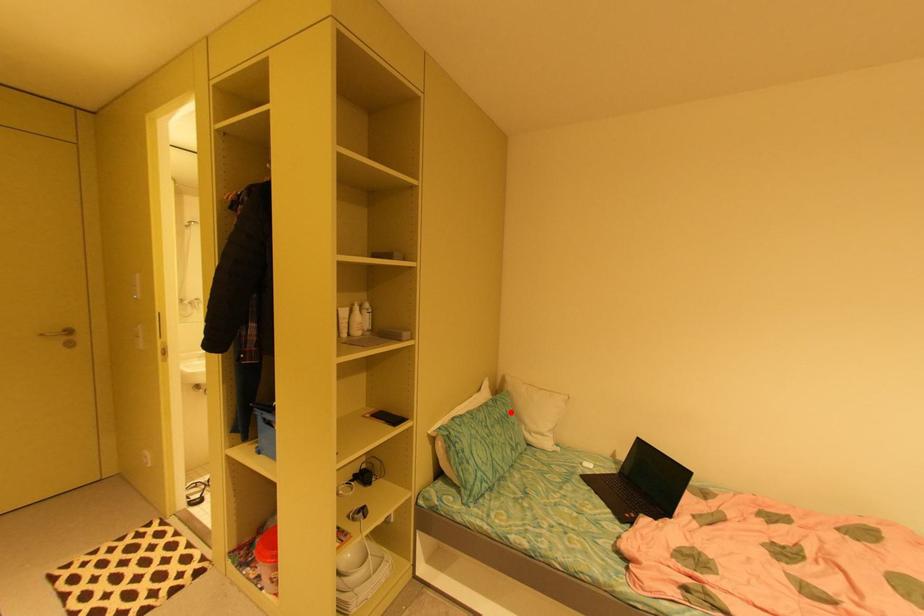
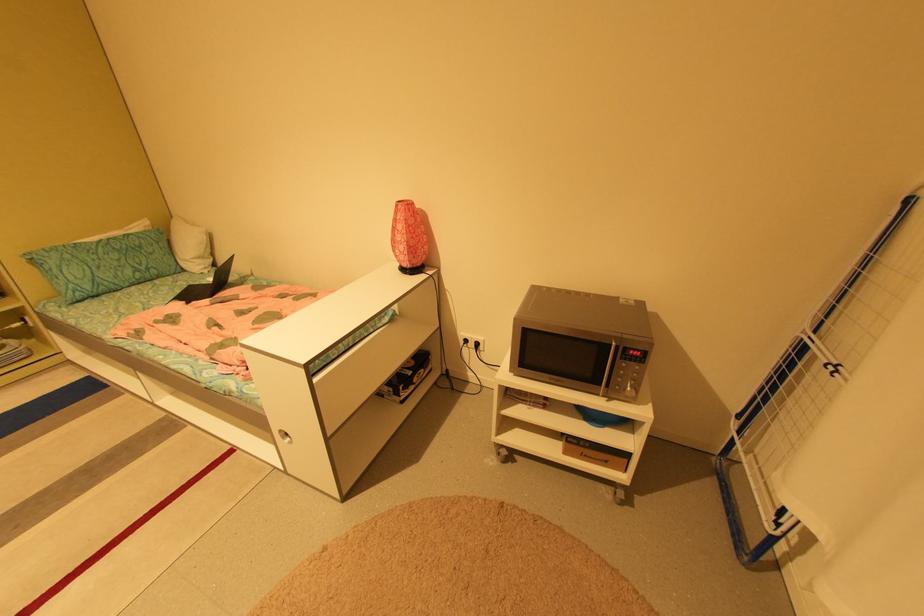
Find the pixel in the second image that matches the highlighted location in the first image.

(142, 244)